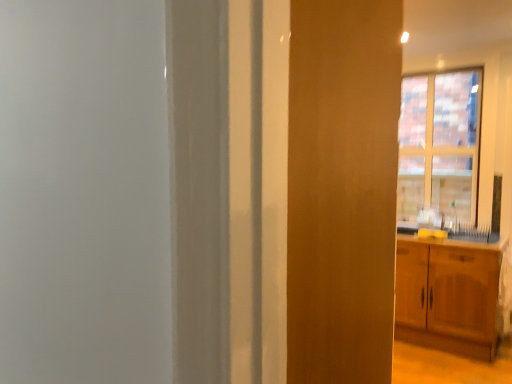
Question: Considering their positions, is wooden cabinet at right located in front of or behind brick textured window at upper right?

Choices:
 (A) behind
 (B) front

Answer: (B)

Question: From a real-world perspective, relative to brick textured window at upper right, is wooden cabinet at right vertically above or below?

Choices:
 (A) above
 (B) below

Answer: (B)

Question: Looking at the image, does wooden cabinet at right seem bigger or smaller compared to brick textured window at upper right?

Choices:
 (A) small
 (B) big

Answer: (B)

Question: Which is correct: brick textured window at upper right is inside wooden cabinet at right, or outside of it?

Choices:
 (A) outside
 (B) inside

Answer: (A)

Question: Is point (456, 127) positioned closer to the camera than point (465, 299)?

Choices:
 (A) closer
 (B) farther

Answer: (B)

Question: Based on their sizes in the image, would you say brick textured window at upper right is bigger or smaller than wooden cabinet at right?

Choices:
 (A) big
 (B) small

Answer: (B)

Question: From a real-world perspective, is brick textured window at upper right positioned above or below wooden cabinet at right?

Choices:
 (A) above
 (B) below

Answer: (A)